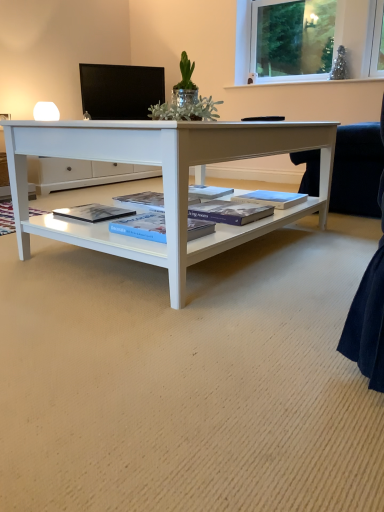
Question: Is the depth of black glossy monitor at upper center greater than that of matte blue magazine at center, which ranks as the 4th magazine in left-to-right order?

Choices:
 (A) no
 (B) yes

Answer: (B)

Question: Is there a large distance between black glossy monitor at upper center and matte blue magazine at center, which ranks as the first magazine in right-to-left order?

Choices:
 (A) no
 (B) yes

Answer: (B)

Question: Is black glossy monitor at upper center thinner than matte blue magazine at center, which ranks as the first magazine in right-to-left order?

Choices:
 (A) yes
 (B) no

Answer: (A)

Question: Could you tell me if black glossy monitor at upper center is facing matte blue magazine at center, which ranks as the first magazine in right-to-left order?

Choices:
 (A) no
 (B) yes

Answer: (B)

Question: From a real-world perspective, is black glossy monitor at upper center positioned over matte blue magazine at center, which ranks as the 4th magazine in left-to-right order, based on gravity?

Choices:
 (A) no
 (B) yes

Answer: (B)

Question: Is point (203, 210) positioned closer to the camera than point (279, 196)?

Choices:
 (A) closer
 (B) farther

Answer: (A)

Question: Choose the correct answer: Is blue matte book at center, acting as the 2th magazine starting from the right, inside matte blue magazine at center, which ranks as the 4th magazine in left-to-right order, or outside it?

Choices:
 (A) inside
 (B) outside

Answer: (B)

Question: From a real-world perspective, is blue matte book at center, which is counted as the third magazine, starting from the left, above or below matte blue magazine at center, which ranks as the first magazine in right-to-left order?

Choices:
 (A) above
 (B) below

Answer: (B)

Question: In the image, is blue matte book at center, acting as the 2th magazine starting from the right, on the left side or the right side of matte blue magazine at center, which ranks as the 4th magazine in left-to-right order?

Choices:
 (A) right
 (B) left

Answer: (B)

Question: From a real-world perspective, relative to blue glossy book at center, which ranks as the 2th magazine in left-to-right order, is matte blue magazine at center, which ranks as the first magazine in right-to-left order, vertically above or below?

Choices:
 (A) above
 (B) below

Answer: (B)

Question: Looking at their shapes, would you say matte blue magazine at center, which ranks as the first magazine in right-to-left order, is wider or thinner than blue glossy book at center, which appears as the 3th magazine when viewed from the right?

Choices:
 (A) wide
 (B) thin

Answer: (B)

Question: Is matte blue magazine at center, which ranks as the first magazine in right-to-left order, inside or outside of blue glossy book at center, which ranks as the 2th magazine in left-to-right order?

Choices:
 (A) inside
 (B) outside

Answer: (B)

Question: In the image, is matte blue magazine at center, which ranks as the first magazine in right-to-left order, positioned in front of or behind blue glossy book at center, which appears as the 3th magazine when viewed from the right?

Choices:
 (A) behind
 (B) front

Answer: (A)

Question: Is blue glossy book at center, which ranks as the 2th magazine in left-to-right order, taller or shorter than blue matte book at center, acting as the 2th magazine starting from the right?

Choices:
 (A) tall
 (B) short

Answer: (A)

Question: Which is correct: blue glossy book at center, which appears as the 3th magazine when viewed from the right, is inside blue matte book at center, acting as the 2th magazine starting from the right, or outside of it?

Choices:
 (A) inside
 (B) outside

Answer: (B)